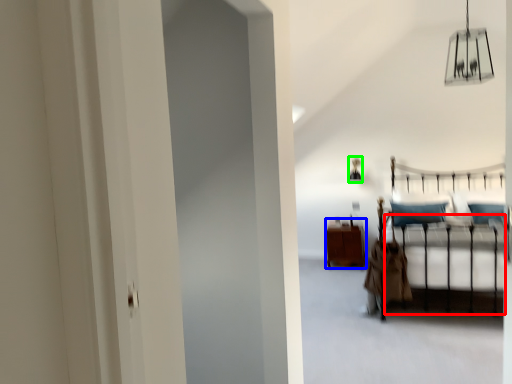
Question: Estimate the real-world distances between objects in this image. Which object is farther from bed frame (highlighted by a red box), furniture (highlighted by a blue box) or lamp (highlighted by a green box)?

Choices:
 (A) furniture
 (B) lamp

Answer: (B)